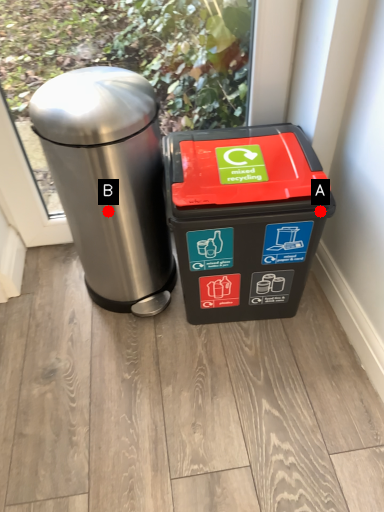
Question: Two points are circled on the image, labeled by A and B beside each circle. Among these points, which one is farthest from the camera?

Choices:
 (A) A is further
 (B) B is further

Answer: (B)